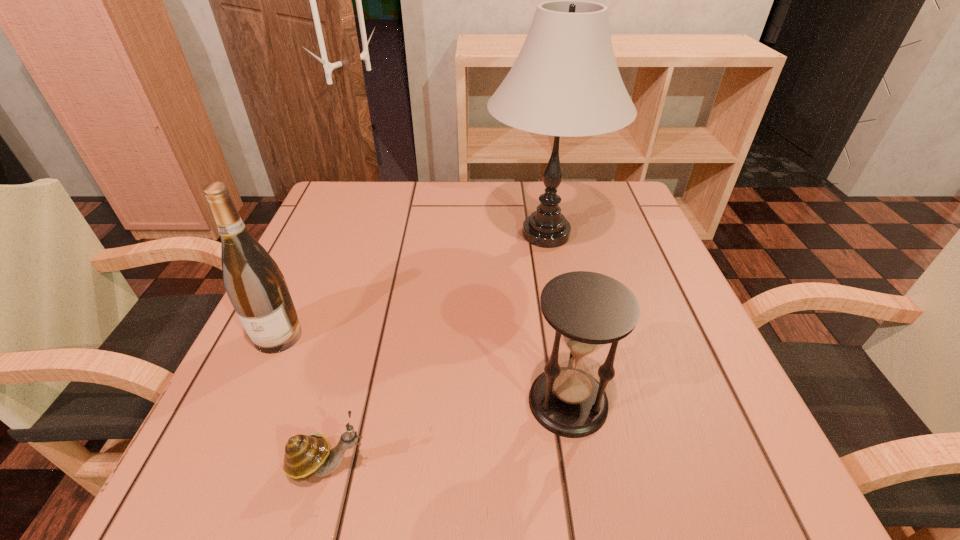
The height and width of the screenshot is (540, 960). I want to click on free space located 0.120m on the back of the third tallest object, so tap(553, 316).

I want to click on free spot located 0.210m on the face of the shortest object, so click(x=525, y=464).

This screenshot has height=540, width=960. Find the location of `object that is at the far edge`. object that is at the far edge is located at coordinates (565, 82).

The height and width of the screenshot is (540, 960). What are the coordinates of `hourglass at the near edge` in the screenshot? It's located at (587, 310).

This screenshot has width=960, height=540. In order to click on snail positioned at the near edge in this screenshot , I will do `click(306, 455)`.

Where is `wine bottle located at the left edge`? wine bottle located at the left edge is located at coordinates (255, 285).

This screenshot has height=540, width=960. What are the coordinates of `snail situated at the left edge` in the screenshot? It's located at (306, 455).

Locate an element on the screen. Image resolution: width=960 pixels, height=540 pixels. object that is at the right edge is located at coordinates (565, 82).

You are a GUI agent. You are given a task and a screenshot of the screen. Output one action in this format:
    pyautogui.click(x=<x>, y=<y>)
    Task: Click on the object that is at the near left corner
    This screenshot has height=540, width=960.
    Given the screenshot: What is the action you would take?
    pyautogui.click(x=306, y=455)

This screenshot has height=540, width=960. In order to click on object located at the far right corner in this screenshot , I will do `click(565, 82)`.